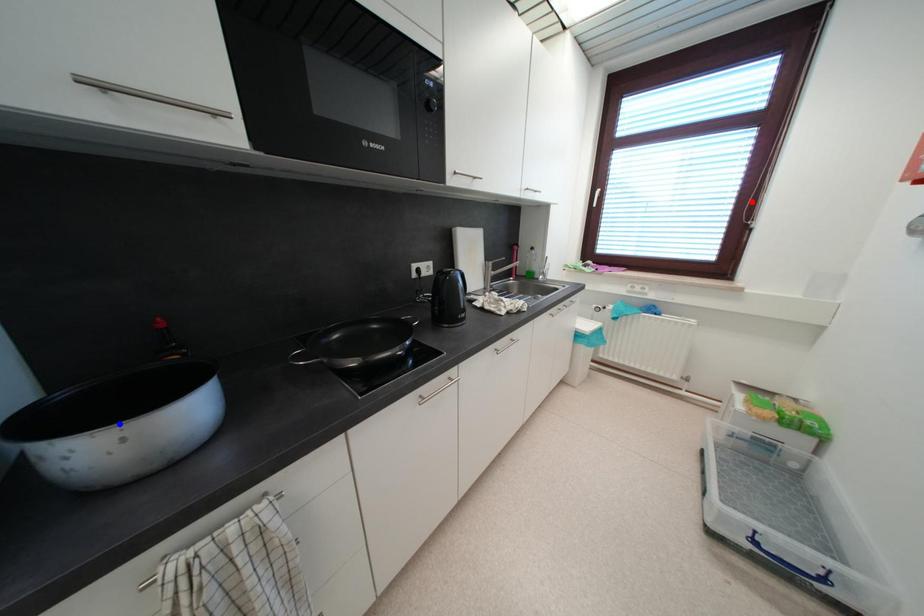
Question: Two points are marked on the image. Which point is closer to the camera?

Choices:
 (A) Blue point is closer.
 (B) Red point is closer.

Answer: (A)